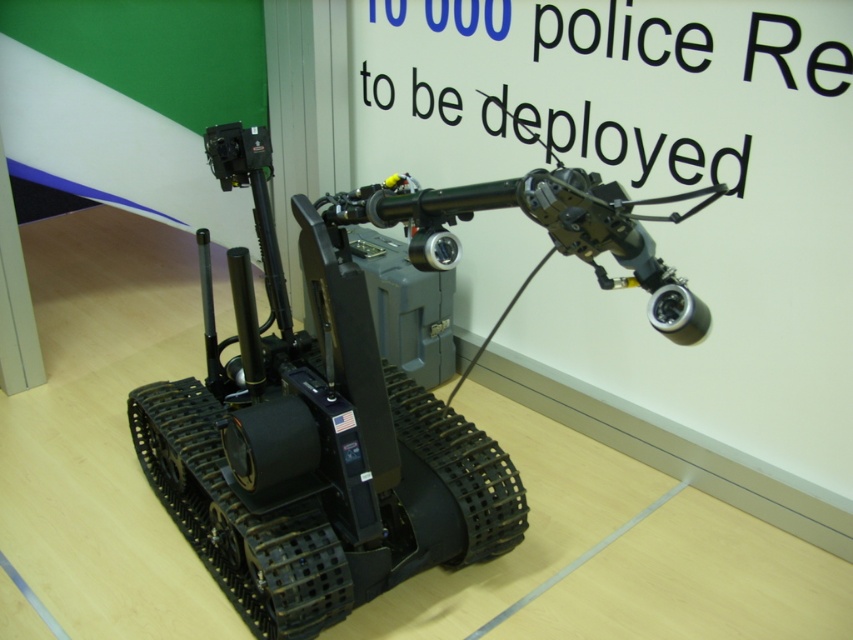
Question: Is metallic/reflective telescope at center wider than white plastic text at upper center?

Choices:
 (A) no
 (B) yes

Answer: (B)

Question: Which point is closer to the camera taking this photo?

Choices:
 (A) (584, 216)
 (B) (498, 124)

Answer: (A)

Question: Does metallic/reflective telescope at center appear under white plastic text at upper center?

Choices:
 (A) no
 (B) yes

Answer: (B)

Question: Which of the following is the farthest from the observer?

Choices:
 (A) (413, 241)
 (B) (384, 131)

Answer: (B)

Question: From the image, what is the correct spatial relationship of metallic/reflective telescope at center in relation to white plastic text at upper center?

Choices:
 (A) right
 (B) left

Answer: (B)